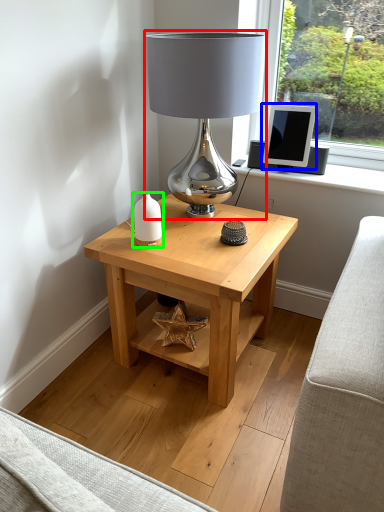
Question: Which is nearer to the lamp (highlighted by a red box)? computer monitor (highlighted by a blue box) or candle holder (highlighted by a green box).

Choices:
 (A) computer monitor
 (B) candle holder

Answer: (B)